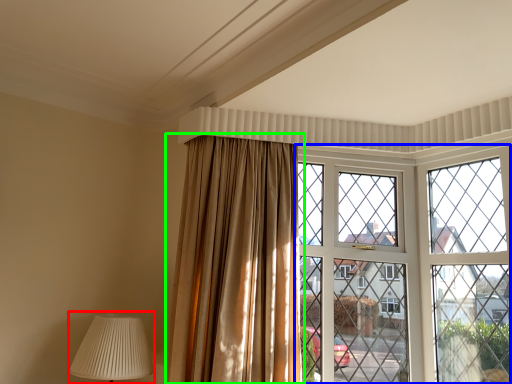
Question: Based on their relative distances, which object is nearer to table lamp (highlighted by a red box)? Choose from window (highlighted by a blue box) and curtain (highlighted by a green box).

Choices:
 (A) window
 (B) curtain

Answer: (B)